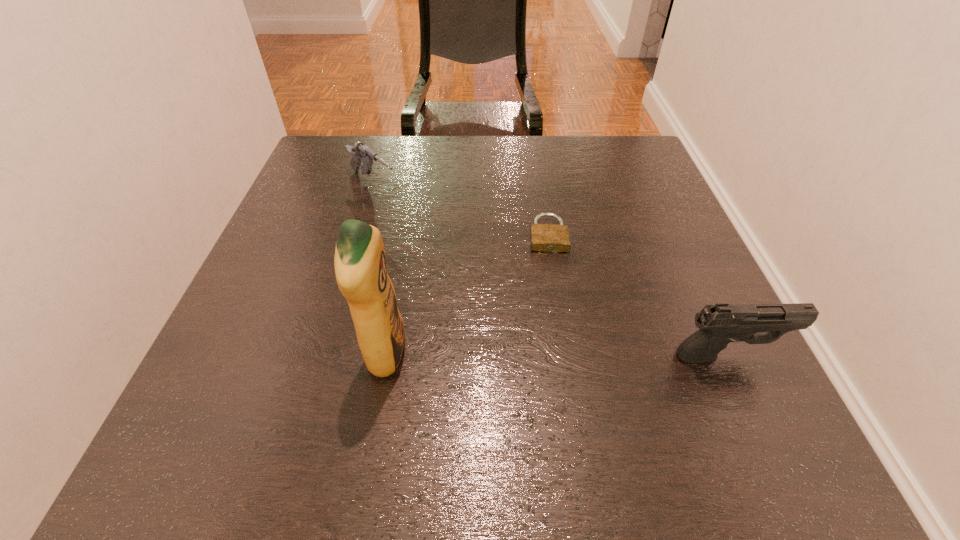
Locate an element on the screen. free point that satisfies the following two spatial constraints: 1. on the front side of the second farthest object; 2. on the right side of the third tallest object is located at coordinates (359, 234).